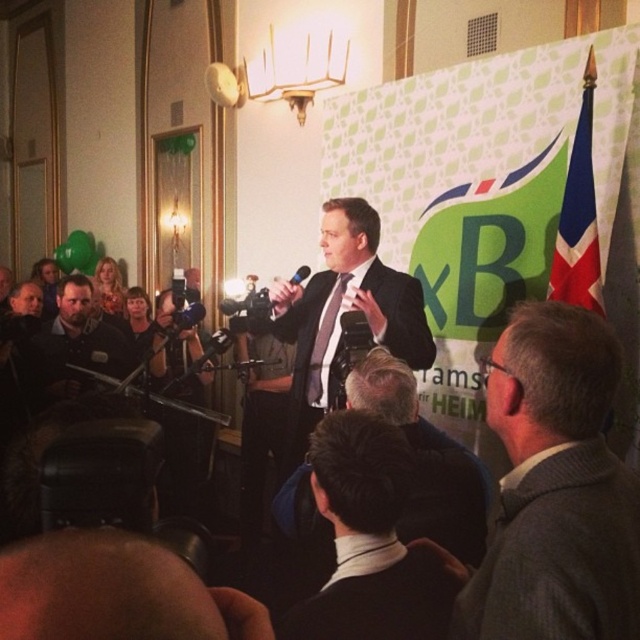
From the picture: Is dark suit at center below dark gray shirt at left?

Yes, dark suit at center is below dark gray shirt at left.

Where is `dark suit at center`? Image resolution: width=640 pixels, height=640 pixels. dark suit at center is located at coordinates (426, 460).

Image resolution: width=640 pixels, height=640 pixels. Identify the location of dark suit at center. click(426, 460).

Looking at this image, is matte black suit at center below matte black jacket at upper left?

Yes.

Looking at this image, who is more forward, [308,362] or [52,262]?

Point [308,362] is more forward.

Find the location of a particular element. matte black suit at center is located at coordinates (342, 310).

At what (x,y) coordinates should I click in order to perform the action: click on matte black suit at center. Please return your answer as a coordinate pair (x, y). Image resolution: width=640 pixels, height=640 pixels. Looking at the image, I should click on (342, 310).

Based on the photo, which is above, dark gray shirt at left or blonde hair at upper left?

blonde hair at upper left is higher up.

Is dark gray shirt at left to the right of blonde hair at upper left from the viewer's perspective?

Indeed, dark gray shirt at left is positioned on the right side of blonde hair at upper left.

Locate an element on the screen. This screenshot has width=640, height=640. dark gray shirt at left is located at coordinates (74, 344).

Image resolution: width=640 pixels, height=640 pixels. In order to click on dark gray shirt at left in this screenshot , I will do `click(74, 344)`.